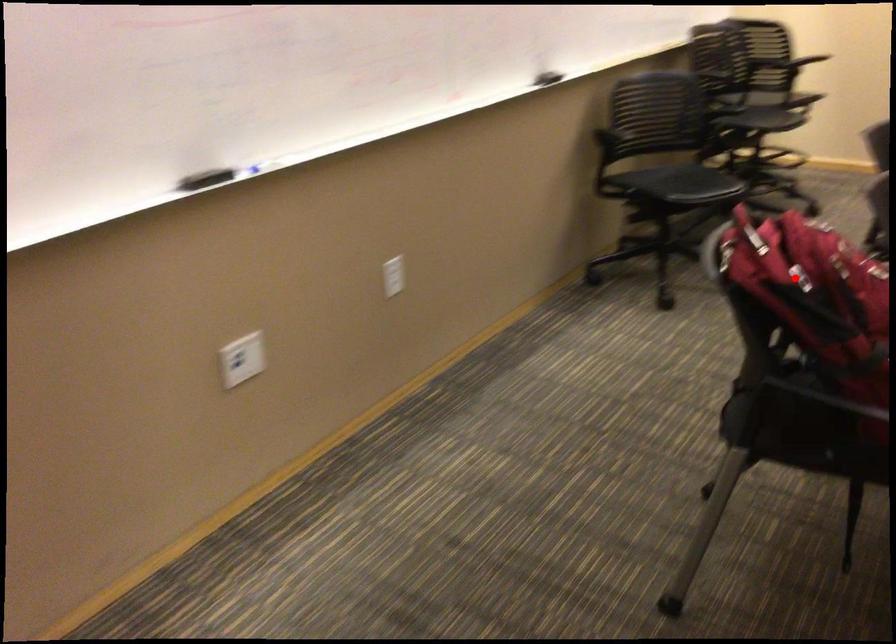
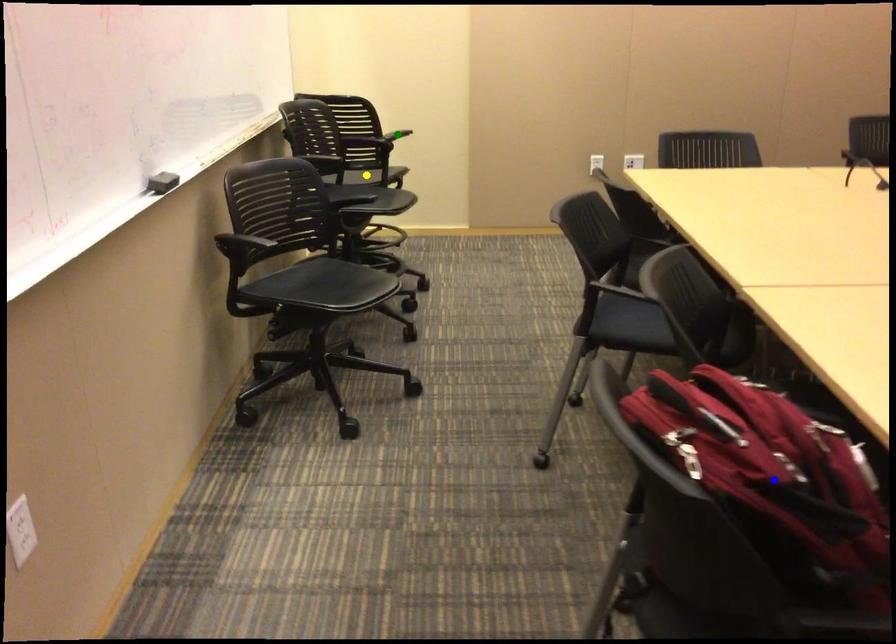
Question: I am providing you with two images of the same scene from different viewpoints. A red point is marked on the first image. You are given multiple points on the second image. In image 2, which mark is for the same physical point as the one in image 1?

Choices:
 (A) blue point
 (B) green point
 (C) yellow point

Answer: (A)